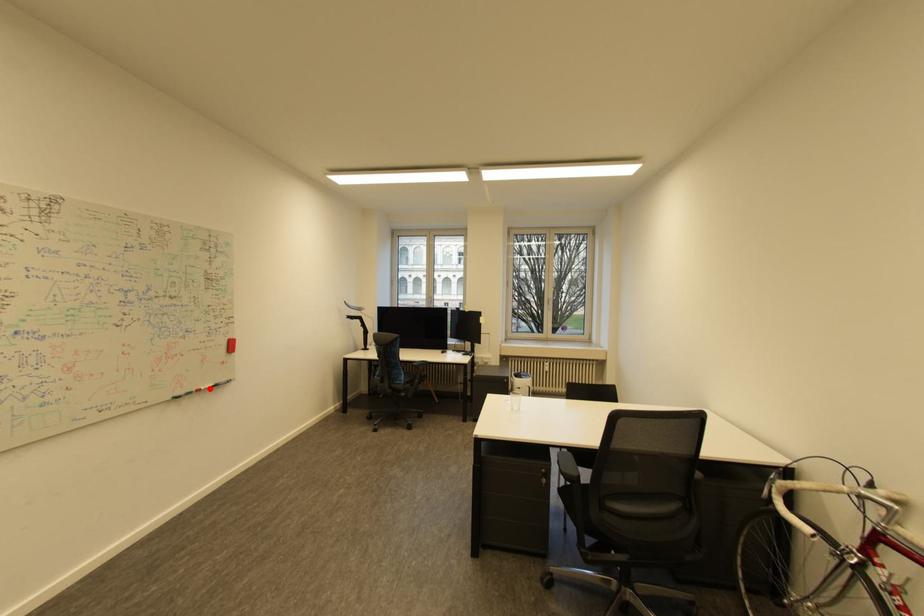
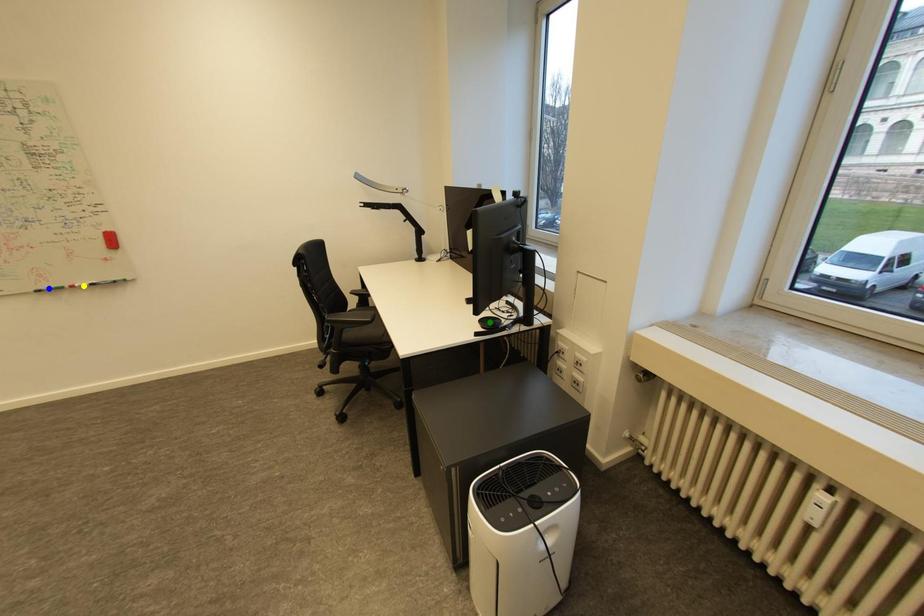
Question: I am providing you with two images of the same scene from different viewpoints. A red point is marked on the first image. You are given multiple points on the second image. Which spot in image 2 lines up with the point in image 1?

Choices:
 (A) green point
 (B) blue point
 (C) yellow point

Answer: (C)